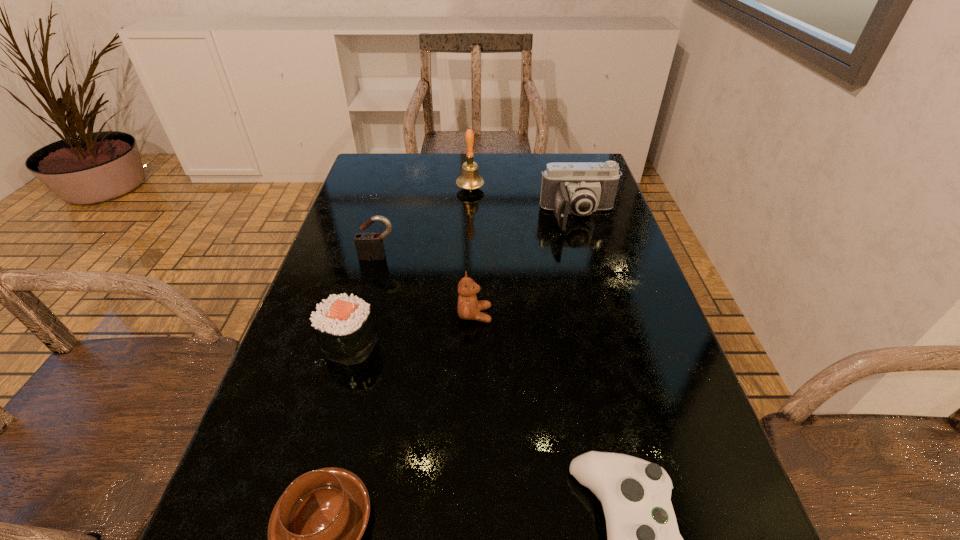
This screenshot has height=540, width=960. In order to click on vacant area that lies between the camera and the padlock in this screenshot , I will do `click(478, 237)`.

Where is `empty space that is in between the third farthest object and the second farthest object`? This screenshot has height=540, width=960. empty space that is in between the third farthest object and the second farthest object is located at coordinates (478, 237).

I want to click on free spot between the teddy bear and the padlock, so click(426, 286).

Identify the location of blank region between the second farthest object and the third farthest object. The height and width of the screenshot is (540, 960). (478, 237).

Where is `vacant region between the padlock and the teddy bear`? vacant region between the padlock and the teddy bear is located at coordinates click(x=426, y=286).

Find the location of a particular element. The width and height of the screenshot is (960, 540). object that stands as the second closest to the sushi is located at coordinates (314, 534).

The height and width of the screenshot is (540, 960). Identify the location of the fifth closest object relative to the farthest object. (643, 539).